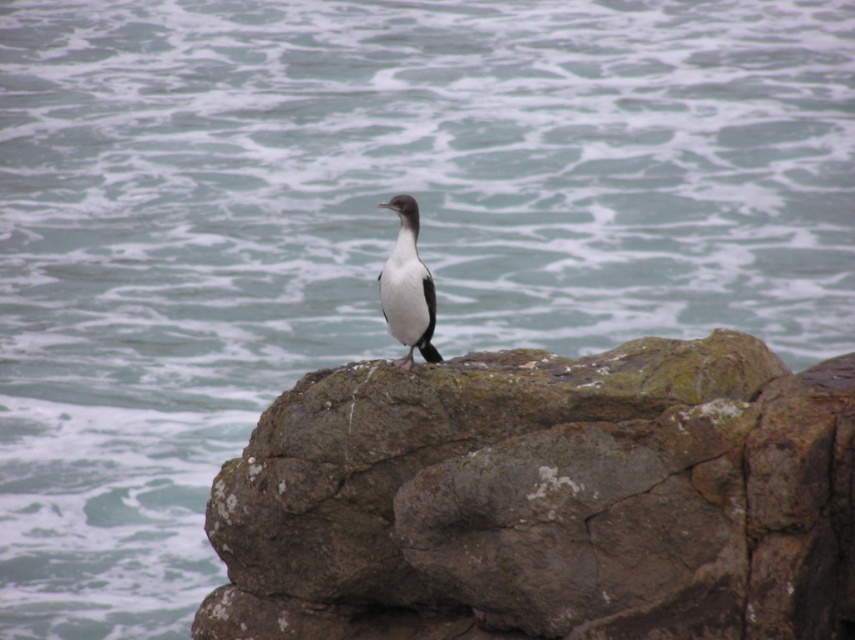
Question: Which point is farther to the camera?

Choices:
 (A) rough textured rock at center
 (B) white glossy bird at center

Answer: (B)

Question: Can you confirm if rough textured rock at center is thinner than white glossy bird at center?

Choices:
 (A) yes
 (B) no

Answer: (B)

Question: Can you confirm if rough textured rock at center is positioned above white glossy bird at center?

Choices:
 (A) yes
 (B) no

Answer: (B)

Question: Among these objects, which one is farthest from the camera?

Choices:
 (A) white glossy bird at center
 (B) rough textured rock at center

Answer: (A)

Question: Is rough textured rock at center to the left of white glossy bird at center from the viewer's perspective?

Choices:
 (A) yes
 (B) no

Answer: (B)